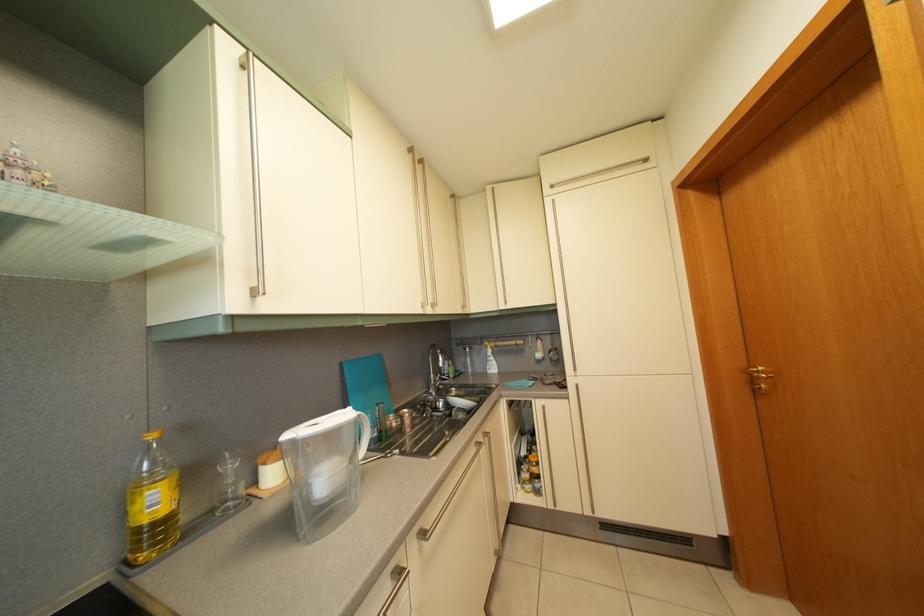
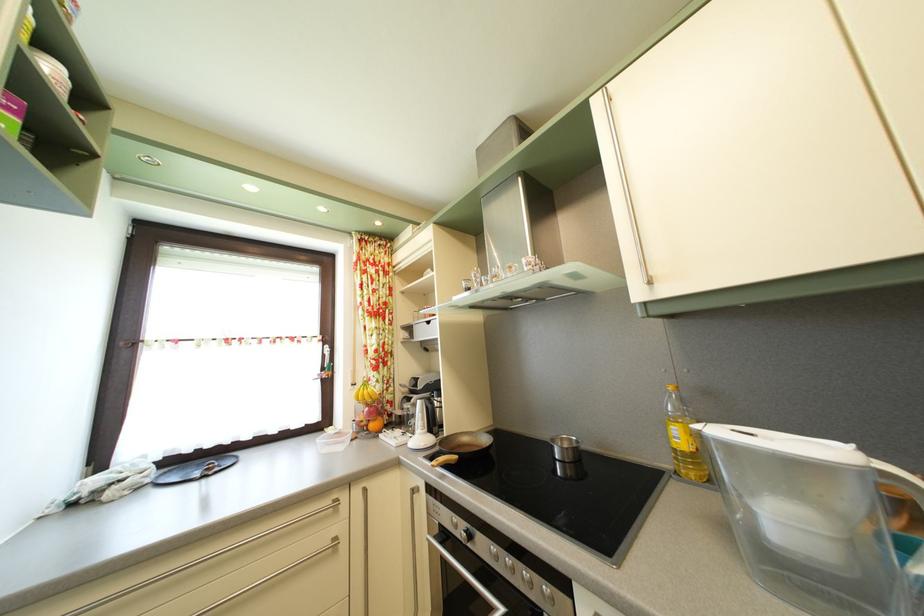
Where in the second image is the point corresponding to the point at 233,53 from the first image?

(604, 111)